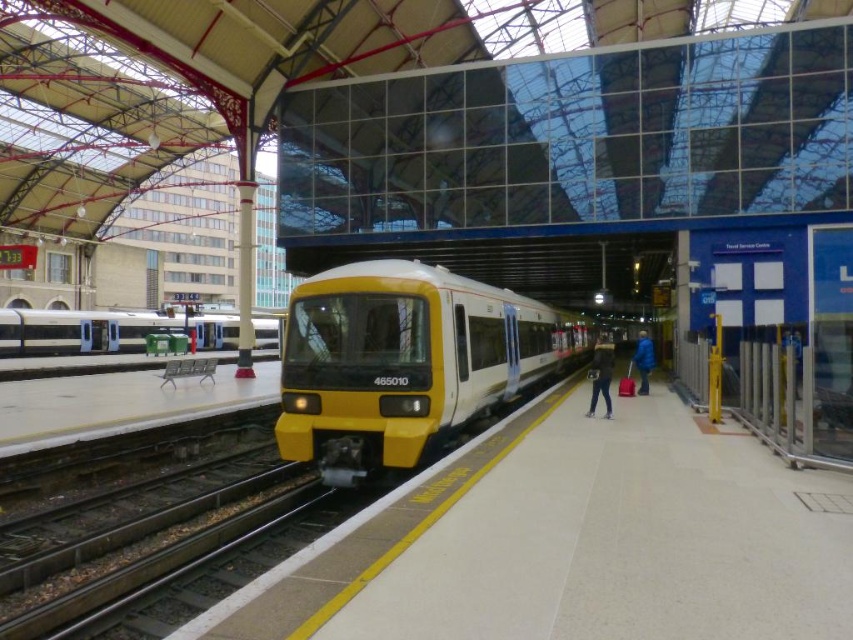
You are a photographer standing at the train station. You want to take a photo that includes both the yellow matte train at center and the dark blue jacket at center. Which object should you focus on first if you want the larger one to be in sharp focus?

The yellow matte train at center is larger in size than the dark blue jacket at center. Therefore, you should focus on the yellow matte train at center first to ensure it is in sharp focus since it is the larger object.

You are a passenger waiting at the train station. You see the matte silver train at left and the dark blue jacket at center. How far apart are these two objects?

The matte silver train at left and the dark blue jacket at center are 28.51 meters apart from each other.

You are a passenger waiting at the train station. You notice the yellow matte train at center and the blue fabric jacket at right. Which object takes up more space in the scene?

The yellow matte train at center is larger in size than the blue fabric jacket at right, so it takes up more space in the scene.